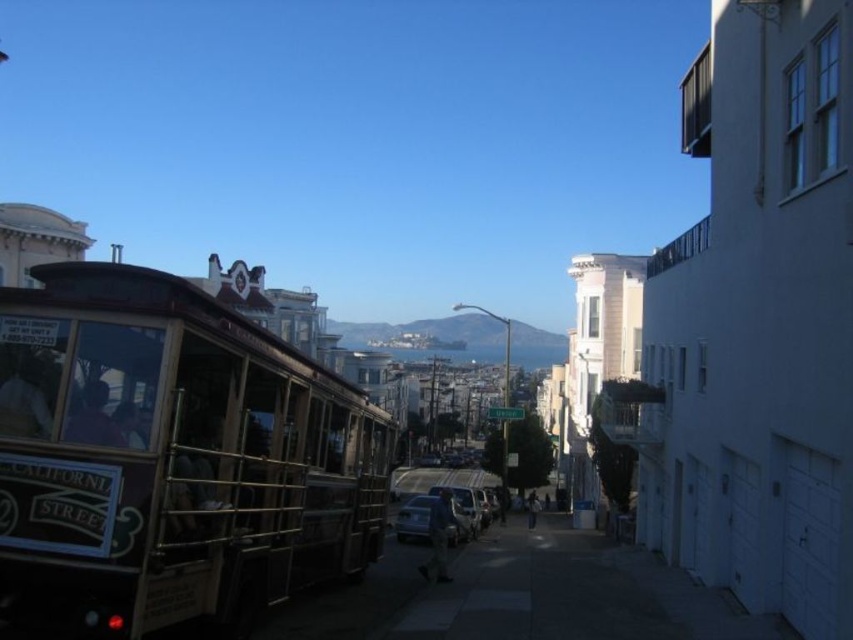
Does wooden polished cable car at left lie in front of satin silver sedan at center?

Yes, it is.

Is point (10, 336) positioned after point (422, 504)?

No.

This screenshot has width=853, height=640. I want to click on wooden polished cable car at left, so click(x=171, y=458).